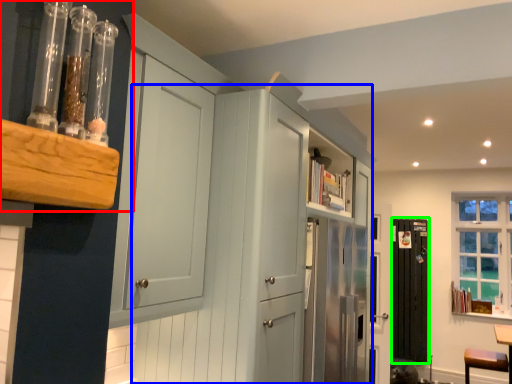
Question: Considering the real-world distances, which object is closest to shelf (highlighted by a red box)? dresser (highlighted by a blue box) or screen door (highlighted by a green box).

Choices:
 (A) dresser
 (B) screen door

Answer: (A)